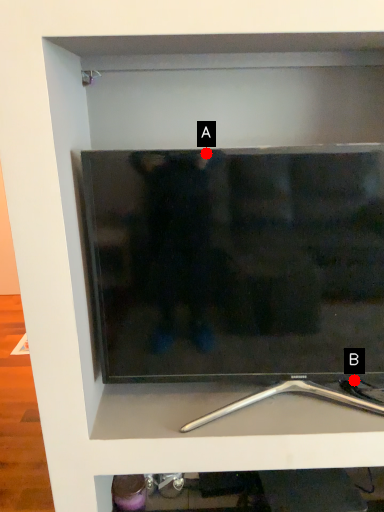
Question: Two points are circled on the image, labeled by A and B beside each circle. Which of the following is the farthest from the observer?

Choices:
 (A) A is further
 (B) B is further

Answer: (B)